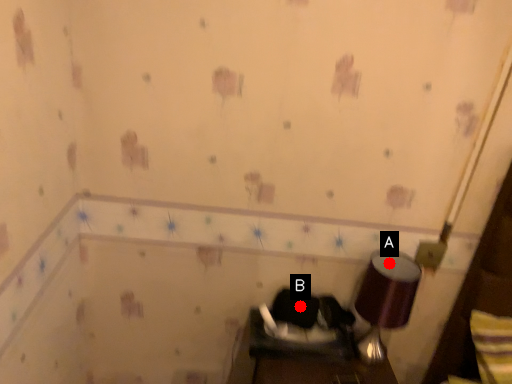
Question: Two points are circled on the image, labeled by A and B beside each circle. Which point is farther from the camera taking this photo?

Choices:
 (A) A is further
 (B) B is further

Answer: (B)